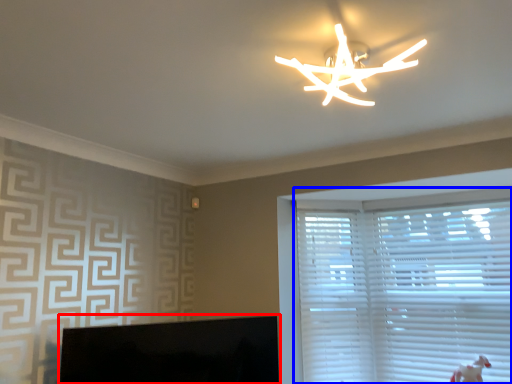
Question: Which object is further to the camera taking this photo, computer monitor (highlighted by a red box) or window blind (highlighted by a blue box)?

Choices:
 (A) computer monitor
 (B) window blind

Answer: (B)